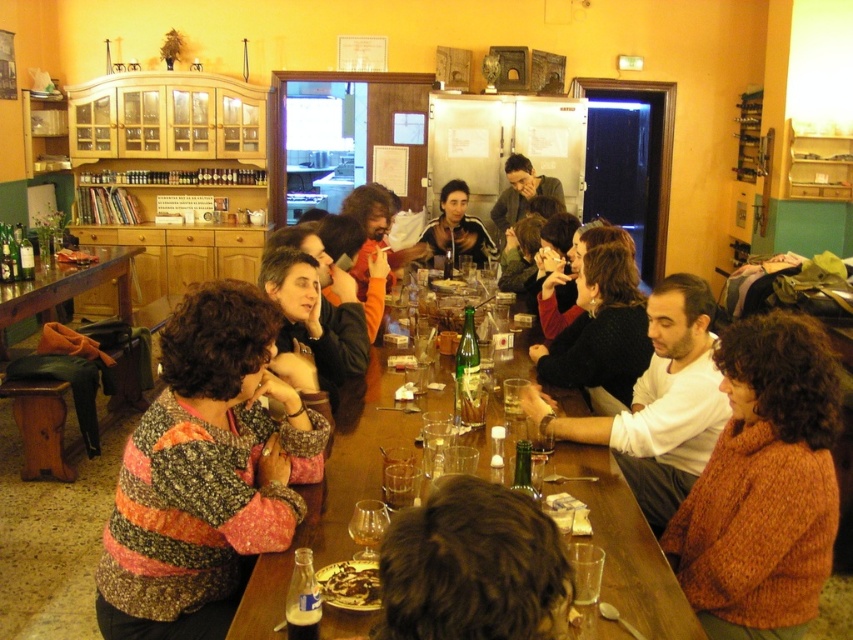
Question: Among these objects, which one is farthest from the camera?

Choices:
 (A) knitted orange sweater at right
 (B) green glass bottle at center
 (C) chocolate cake at center
 (D) translucent plastic bottle at table center

Answer: (B)

Question: Which of the following is the farthest from the observer?

Choices:
 (A) (210, 417)
 (B) (598, 298)
 (C) (73, 264)

Answer: (C)

Question: Is clear glass bottle at upper center closer to camera compared to chocolate cake at center?

Choices:
 (A) yes
 (B) no

Answer: (B)

Question: Can you confirm if striped sweater at center is positioned to the left of green glass bottle at center?

Choices:
 (A) yes
 (B) no

Answer: (A)

Question: Which point is farther to the camera?

Choices:
 (A) (355, 336)
 (B) (79, 256)
 (C) (155, 179)

Answer: (C)

Question: From the image, what is the correct spatial relationship of matte black sweater at center in relation to chocolate cake at center?

Choices:
 (A) right
 (B) left

Answer: (B)